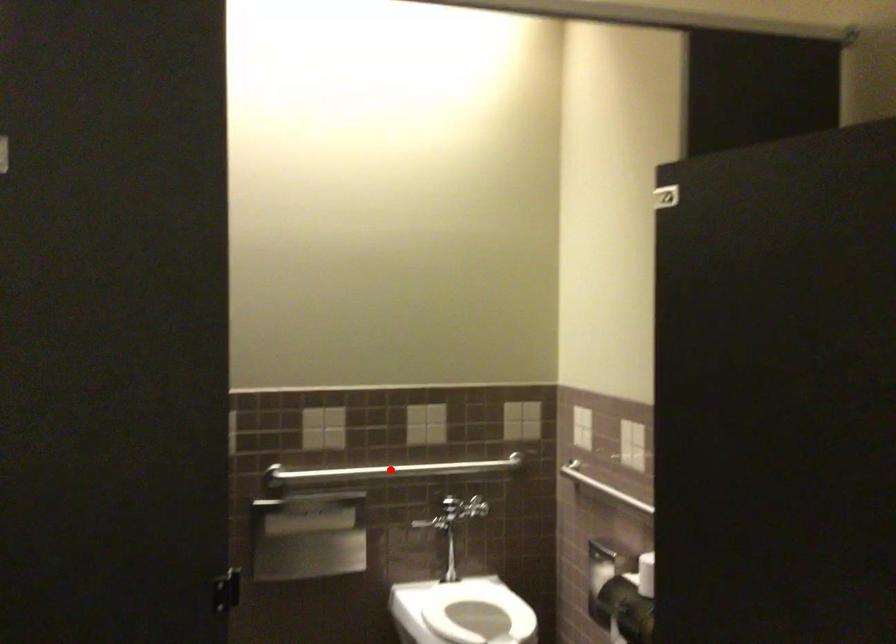
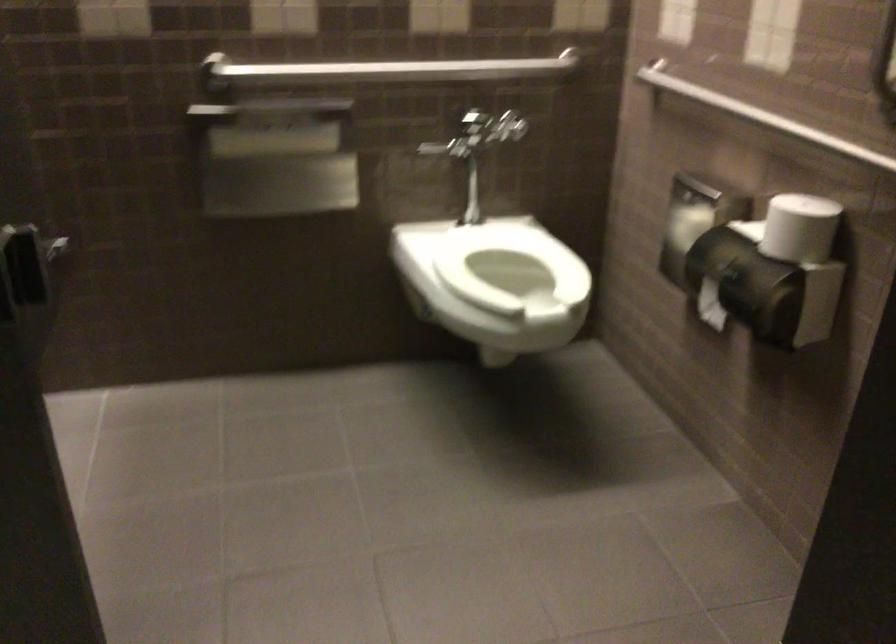
Question: I am providing you with two images of the same scene from different viewpoints. In image1, a red point is highlighted. Considering the same 3D point in image2, which of the following is correct?

Choices:
 (A) It is closer
 (B) It is farther

Answer: (A)